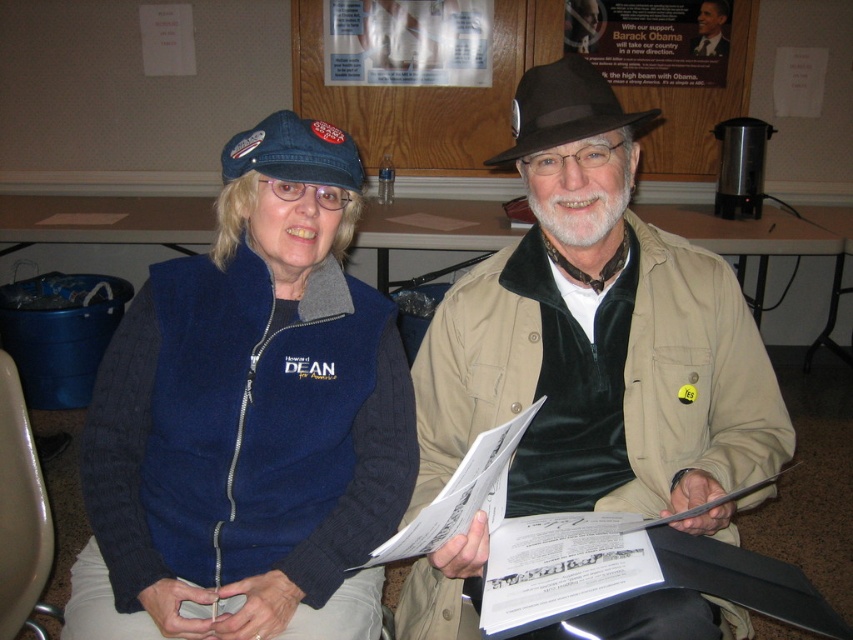
Does corduroy fabric pants at lower center have a greater height compared to brown felt hat at center?

No.

Does point (235, 612) come in front of point (573, 52)?

Yes.

Locate an element on the screen. corduroy fabric pants at lower center is located at coordinates (100, 604).

Who is taller, blue fleece vest at center or beige fabric jacket at center?

Standing taller between the two is beige fabric jacket at center.

Does blue fleece vest at center have a lesser height compared to beige fabric jacket at center?

Indeed, blue fleece vest at center has a lesser height compared to beige fabric jacket at center.

The image size is (853, 640). Describe the element at coordinates (250, 413) in the screenshot. I see `blue fleece vest at center` at that location.

The image size is (853, 640). Identify the location of blue fleece vest at center. (250, 413).

Is beige fabric jacket at center above brown felt hat at center?

No, beige fabric jacket at center is not above brown felt hat at center.

Which is behind, point (567, 444) or point (511, 164)?

Positioned behind is point (511, 164).

Where is `beige fabric jacket at center`? This screenshot has width=853, height=640. beige fabric jacket at center is located at coordinates (596, 333).